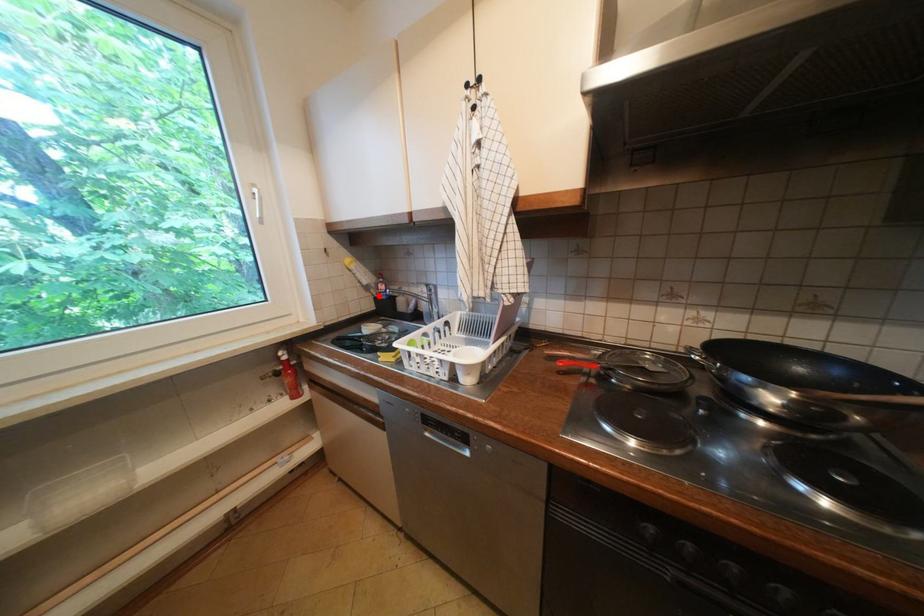
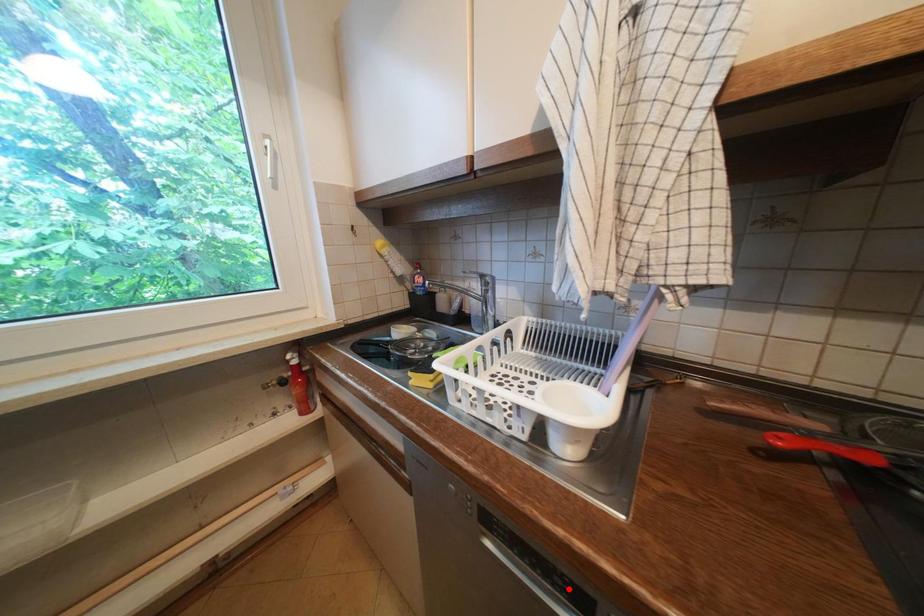
I am providing you with two images of the same scene from different viewpoints. A red point is marked on the first image and another point is marked on the second image. Is the marked point in image1 the same physical position as the marked point in image2?

No